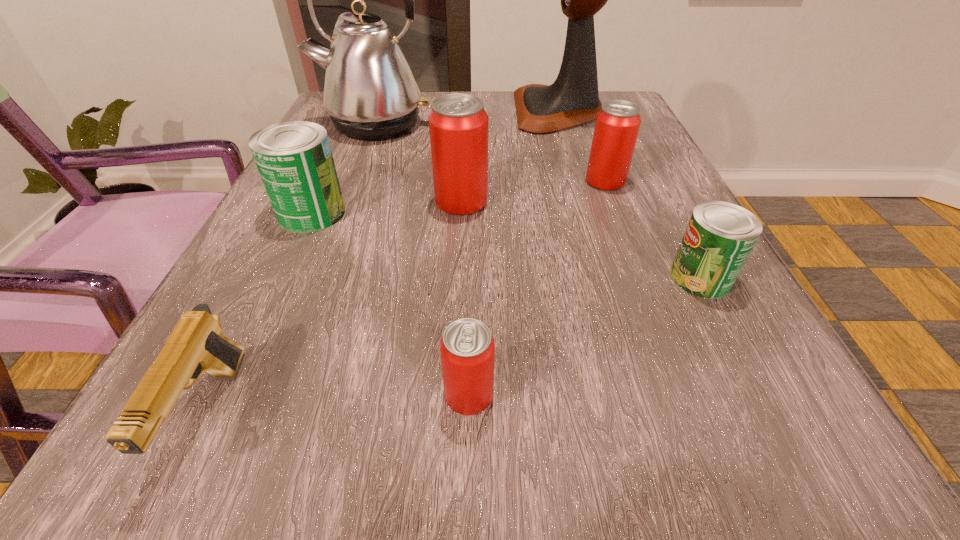
Where is `the smaller green can`? Image resolution: width=960 pixels, height=540 pixels. the smaller green can is located at coordinates (719, 237).

Where is `the nearest red can`? This screenshot has width=960, height=540. the nearest red can is located at coordinates (467, 347).

You are a GUI agent. You are given a task and a screenshot of the screen. Output one action in this format:
    pyautogui.click(x=<x>, y=<y>)
    Task: Click on the smallest red can
    The image size is (960, 540).
    Given the screenshot: What is the action you would take?
    pyautogui.click(x=467, y=347)

Image resolution: width=960 pixels, height=540 pixels. Identify the location of tan pistol. (196, 345).

This screenshot has height=540, width=960. What are the coordinates of `vacant area situated 0.280m on the front-facing side of the fan` in the screenshot? It's located at (400, 111).

You are a GUI agent. You are given a task and a screenshot of the screen. Output one action in this format:
    pyautogui.click(x=<x>, y=<y>)
    Task: Click on the free region located 0.360m on the front-facing side of the fan
    The height and width of the screenshot is (540, 960).
    Given the screenshot: What is the action you would take?
    pyautogui.click(x=368, y=111)

Locate an element on the screen. blank space located on the front-facing side of the fan is located at coordinates (393, 111).

Locate an element on the screen. This screenshot has width=960, height=540. free space located from the spout of the second tallest object is located at coordinates (358, 165).

Where is `free space located on the right of the tallest can`? The image size is (960, 540). free space located on the right of the tallest can is located at coordinates (548, 201).

Locate an element on the screen. The image size is (960, 540). free space located 0.120m on the left of the rightmost red can is located at coordinates (522, 181).